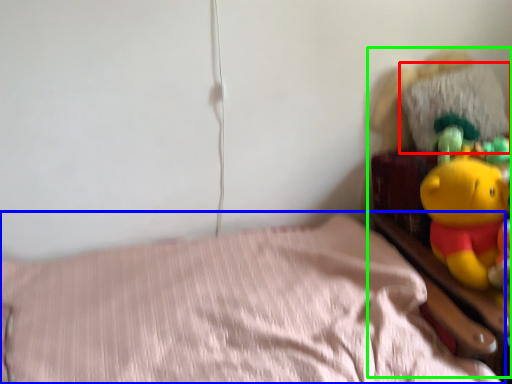
Question: Considering the real-world distances, which object is closest to pillow (highlighted by a red box)? bed (highlighted by a blue box) or toy (highlighted by a green box).

Choices:
 (A) bed
 (B) toy

Answer: (B)